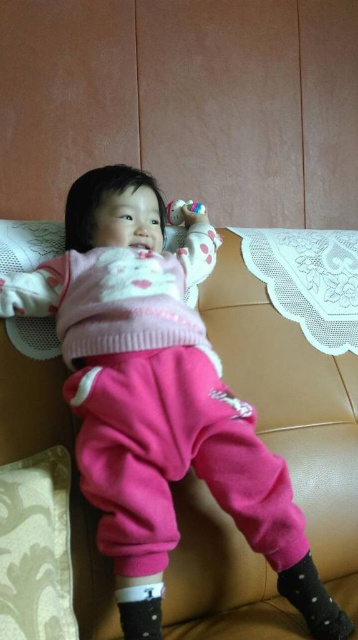
Between textured cream pillow at lower left and translucent plastic toy at upper center, which one appears on the right side from the viewer's perspective?

Positioned to the right is translucent plastic toy at upper center.

What do you see at coordinates (36, 548) in the screenshot? I see `textured cream pillow at lower left` at bounding box center [36, 548].

Find the location of `textured cream pillow at lower left`. textured cream pillow at lower left is located at coordinates (36, 548).

Which is more to the left, pink fleece sweater at upper center or translucent plastic toy at upper center?

Positioned to the left is pink fleece sweater at upper center.

Is point (171, 346) positioned after point (182, 211)?

No, it is not.

Is point (337, 609) behind point (182, 216)?

No.

The width and height of the screenshot is (358, 640). I want to click on pink fleece sweater at upper center, so (x=157, y=397).

Can you confirm if pink fleece sweater at upper center is shorter than textured cream pillow at lower left?

Incorrect, pink fleece sweater at upper center's height does not fall short of textured cream pillow at lower left's.

Who is more forward, (200, 413) or (49, 481)?

Point (200, 413) is in front.

You are a GUI agent. You are given a task and a screenshot of the screen. Output one action in this format:
    pyautogui.click(x=<x>, y=<y>)
    Task: Click on the pink fleece sweater at upper center
    This screenshot has width=358, height=640.
    Given the screenshot: What is the action you would take?
    pyautogui.click(x=157, y=397)